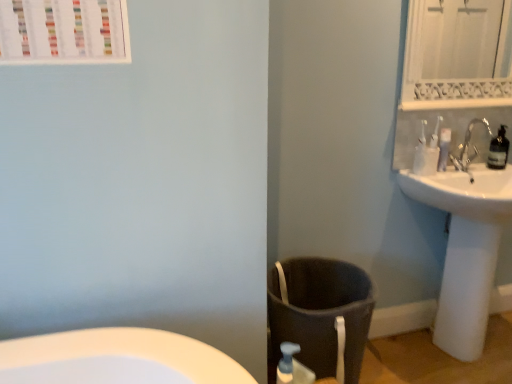
Question: Should I look upward or downward to see white ceramic faucet at upper right?

Choices:
 (A) up
 (B) down

Answer: (A)

Question: From a real-world perspective, is dark gray fabric laundry basket at lower center over white ceramic faucet at upper right?

Choices:
 (A) no
 (B) yes

Answer: (A)

Question: Is dark gray fabric laundry basket at lower center wider than white ceramic faucet at upper right?

Choices:
 (A) no
 (B) yes

Answer: (B)

Question: From a real-world perspective, is dark gray fabric laundry basket at lower center located beneath white ceramic faucet at upper right?

Choices:
 (A) yes
 (B) no

Answer: (A)

Question: Could you tell me if dark gray fabric laundry basket at lower center is turned towards white ceramic faucet at upper right?

Choices:
 (A) no
 (B) yes

Answer: (A)

Question: From the image's perspective, is dark gray fabric laundry basket at lower center over white ceramic faucet at upper right?

Choices:
 (A) yes
 (B) no

Answer: (B)

Question: Does dark gray fabric laundry basket at lower center appear on the left side of white ceramic faucet at upper right?

Choices:
 (A) no
 (B) yes

Answer: (B)

Question: Can you confirm if white textured mirror at upper right is taller than white ceramic faucet at upper right?

Choices:
 (A) no
 (B) yes

Answer: (B)

Question: Does white textured mirror at upper right contain white ceramic faucet at upper right?

Choices:
 (A) no
 (B) yes

Answer: (A)

Question: Is white textured mirror at upper right facing away from white ceramic faucet at upper right?

Choices:
 (A) no
 (B) yes

Answer: (A)

Question: Considering the relative positions of white textured mirror at upper right and white ceramic faucet at upper right in the image provided, is white textured mirror at upper right behind white ceramic faucet at upper right?

Choices:
 (A) yes
 (B) no

Answer: (B)

Question: Is white textured mirror at upper right to the left of white ceramic faucet at upper right from the viewer's perspective?

Choices:
 (A) no
 (B) yes

Answer: (B)

Question: Does white textured mirror at upper right have a smaller size compared to white ceramic faucet at upper right?

Choices:
 (A) yes
 (B) no

Answer: (B)

Question: Can you confirm if transparent plastic bottle at upper right is shorter than white plastic toothbrushes at upper right?

Choices:
 (A) yes
 (B) no

Answer: (B)